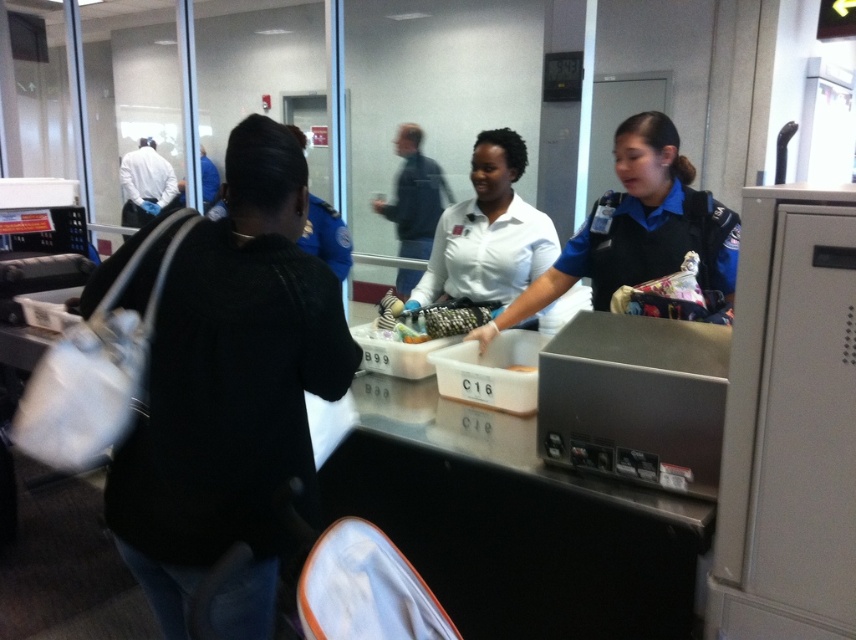
Based on the scene description, where is the black sweater at center located in terms of coordinates?

The black sweater at center is located at point (232, 397).

Based on the photo, you are standing at the security checkpoint and need to determine the relative positions of two points marked in the scene. Which point is closer to you, point (631,182) or point (437,237)?

Point (631,182) is closer to the camera than point (437,237).